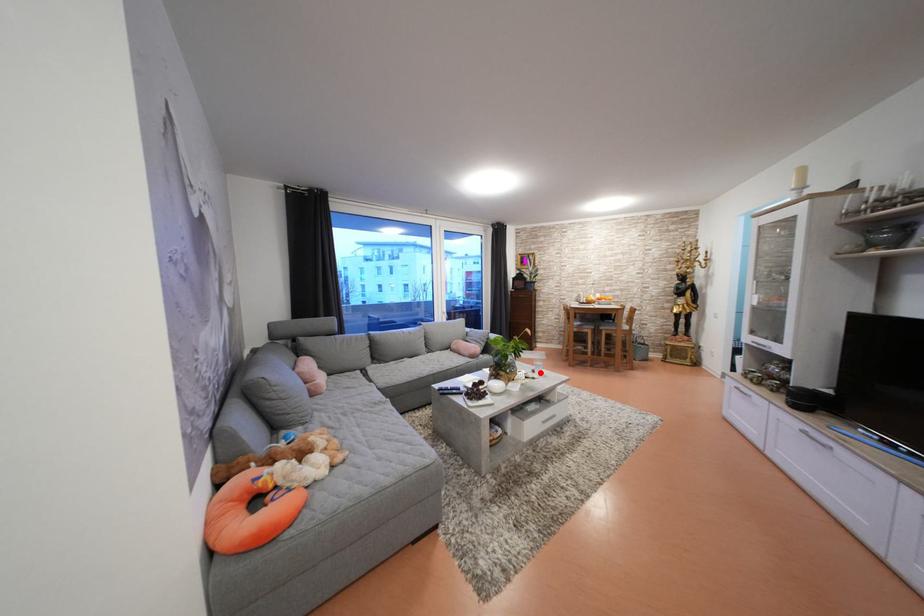
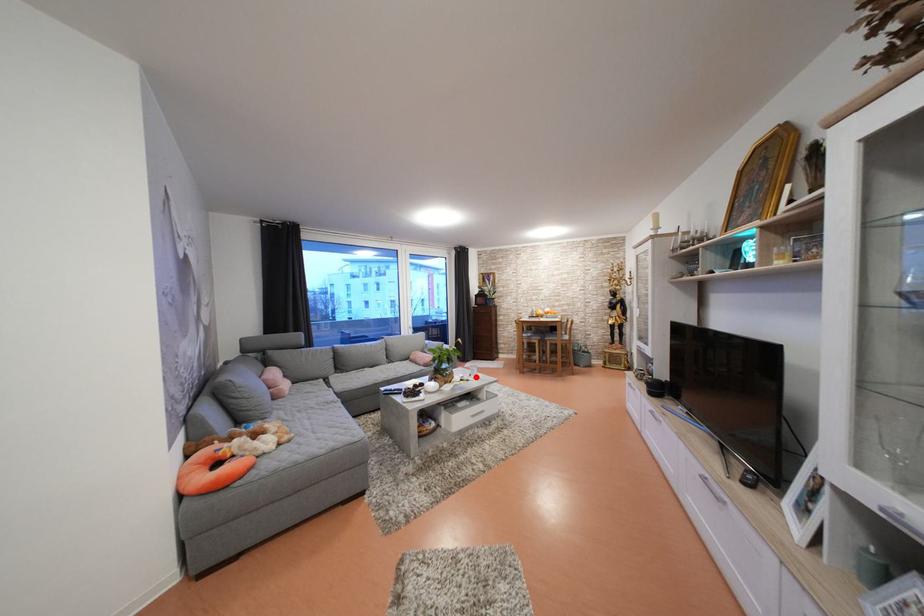
I am providing you with two images of the same scene from different viewpoints. A red point is marked on the first image and another point is marked on the second image. Do the highlighted points in image1 and image2 indicate the same real-world spot?

Yes